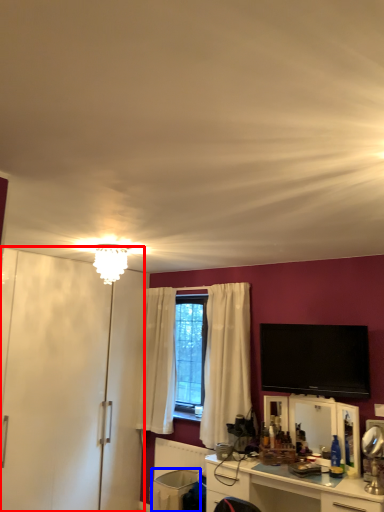
Question: Which object appears closest to the camera in this image, armoire (highlighted by a red box) or trash bin/can (highlighted by a blue box)?

Choices:
 (A) armoire
 (B) trash bin/can

Answer: (A)